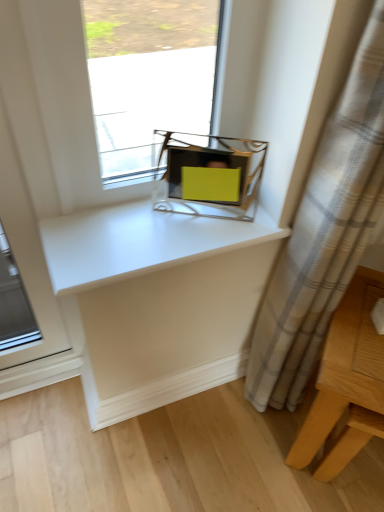
What do you see at coordinates (346, 381) in the screenshot? I see `light wood table at lower right` at bounding box center [346, 381].

Image resolution: width=384 pixels, height=512 pixels. What do you see at coordinates (209, 175) in the screenshot? I see `matte yellow plastic at center` at bounding box center [209, 175].

Locate an element on the screen. The image size is (384, 512). white glossy counter top at center is located at coordinates (139, 242).

What are the coordinates of `light wood table at lower right` in the screenshot? It's located at (346, 381).

Considering the positions of point (164, 221) and point (208, 176), is point (164, 221) closer or farther from the camera than point (208, 176)?

Point (164, 221) is farther from the camera than point (208, 176).

What's the angular difference between white glossy counter top at center and matte yellow plastic at center's facing directions?

The angular difference between white glossy counter top at center and matte yellow plastic at center is 27.5 degrees.

Is white glossy counter top at center wider than matte yellow plastic at center?

Correct, the width of white glossy counter top at center exceeds that of matte yellow plastic at center.

From the picture: From their relative heights in the image, would you say white glossy counter top at center is taller or shorter than light wood table at lower right?

In the image, white glossy counter top at center appears to be shorter than light wood table at lower right.

Is white glossy counter top at center facing away from light wood table at lower right?

No.

Does white glossy counter top at center touch light wood table at lower right?

white glossy counter top at center is not next to light wood table at lower right, and they're not touching.

Who is bigger, white glossy counter top at center or light wood table at lower right?

Bigger between the two is light wood table at lower right.

From a real-world perspective, between light wood table at lower right and white glossy counter top at center, who is vertically lower?

light wood table at lower right is physically lower.

Considering the sizes of objects light wood table at lower right and white glossy counter top at center in the image provided, who is thinner, light wood table at lower right or white glossy counter top at center?

Thinner between the two is white glossy counter top at center.

Does light wood table at lower right have a smaller size compared to white glossy counter top at center?

No, light wood table at lower right is not smaller than white glossy counter top at center.

Is light wood table at lower right not inside matte yellow plastic at center?

Yes, light wood table at lower right is not within matte yellow plastic at center.

Between light wood table at lower right and matte yellow plastic at center, which one has smaller width?

matte yellow plastic at center.

Based on their positions, is light wood table at lower right located to the left or right of matte yellow plastic at center?

Clearly, light wood table at lower right is on the right of matte yellow plastic at center in the image.

How many degrees apart are the facing directions of light wood table at lower right and matte yellow plastic at center?

There is a 17.5-degree angle between the facing directions of light wood table at lower right and matte yellow plastic at center.

Which object is closer to the camera, matte yellow plastic at center or white glossy counter top at center?

white glossy counter top at center is closer to the camera.

From the picture: Is matte yellow plastic at center not close to white glossy counter top at center?

matte yellow plastic at center is near white glossy counter top at center, not far away.

Considering the relative sizes of matte yellow plastic at center and white glossy counter top at center in the image provided, is matte yellow plastic at center wider than white glossy counter top at center?

No, matte yellow plastic at center is not wider than white glossy counter top at center.

Between matte yellow plastic at center and light wood table at lower right, which one appears on the left side from the viewer's perspective?

matte yellow plastic at center.

Which of these two, matte yellow plastic at center or light wood table at lower right, is bigger?

With larger size is light wood table at lower right.

Does point (231, 188) come closer to viewer compared to point (362, 344)?

No.

Identify the location of equipment that appears above the light wood table at lower right (from the image's perspective). Image resolution: width=384 pixels, height=512 pixels. (209, 175).

You are a GUI agent. You are given a task and a screenshot of the screen. Output one action in this format:
    pyautogui.click(x=<x>, y=<y>)
    Task: Click on the equipment above the white glossy counter top at center (from the image's perspective)
    This screenshot has height=512, width=384.
    Given the screenshot: What is the action you would take?
    pyautogui.click(x=209, y=175)

This screenshot has width=384, height=512. In order to click on table below the white glossy counter top at center (from a real-world perspective) in this screenshot , I will do `click(346, 381)`.

Which object lies further to the anchor point white glossy counter top at center, matte yellow plastic at center or light wood table at lower right?

Among the two, light wood table at lower right is located further to white glossy counter top at center.

From the image, which object appears to be nearer to light wood table at lower right, matte yellow plastic at center or white glossy counter top at center?

The object closer to light wood table at lower right is white glossy counter top at center.

Looking at the image, which one is located closer to light wood table at lower right, white glossy counter top at center or matte yellow plastic at center?

The object closer to light wood table at lower right is white glossy counter top at center.

Looking at this image, based on their spatial positions, is light wood table at lower right or white glossy counter top at center further from matte yellow plastic at center?

light wood table at lower right is positioned further to the anchor matte yellow plastic at center.

Looking at the image, which one is located further to matte yellow plastic at center, white glossy counter top at center or light wood table at lower right?

light wood table at lower right is further to matte yellow plastic at center.

Which object lies further to the anchor point white glossy counter top at center, light wood table at lower right or matte yellow plastic at center?

The object further to white glossy counter top at center is light wood table at lower right.

Identify the location of counter top that lies between matte yellow plastic at center and light wood table at lower right from top to bottom. (139, 242).